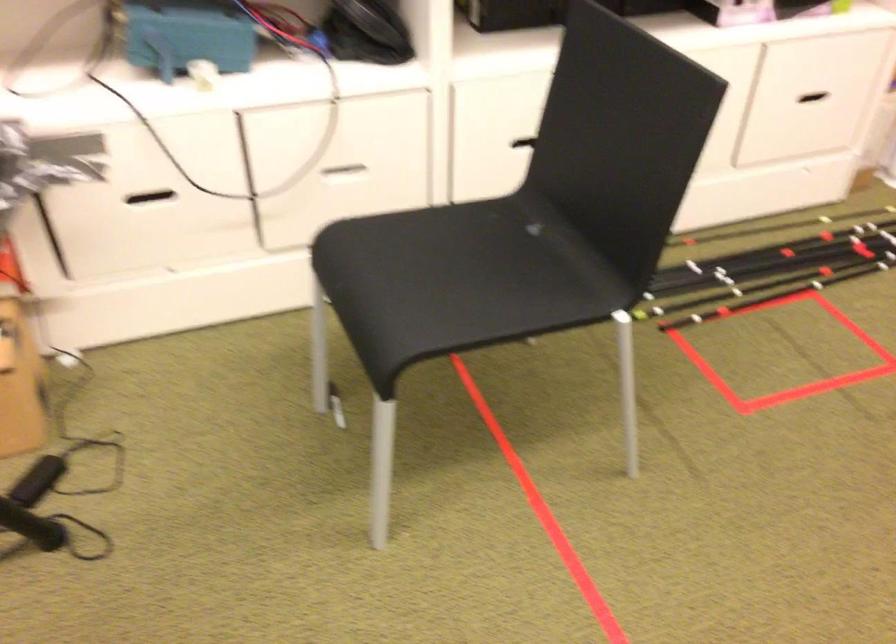
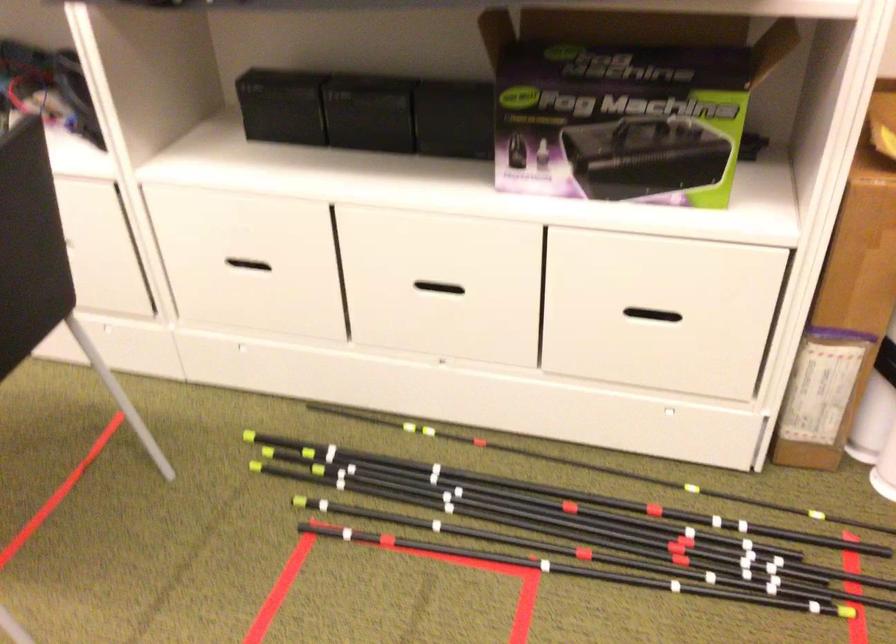
Locate, in the second image, the point that corresponds to the point at 822,243 in the first image.

(638, 524)